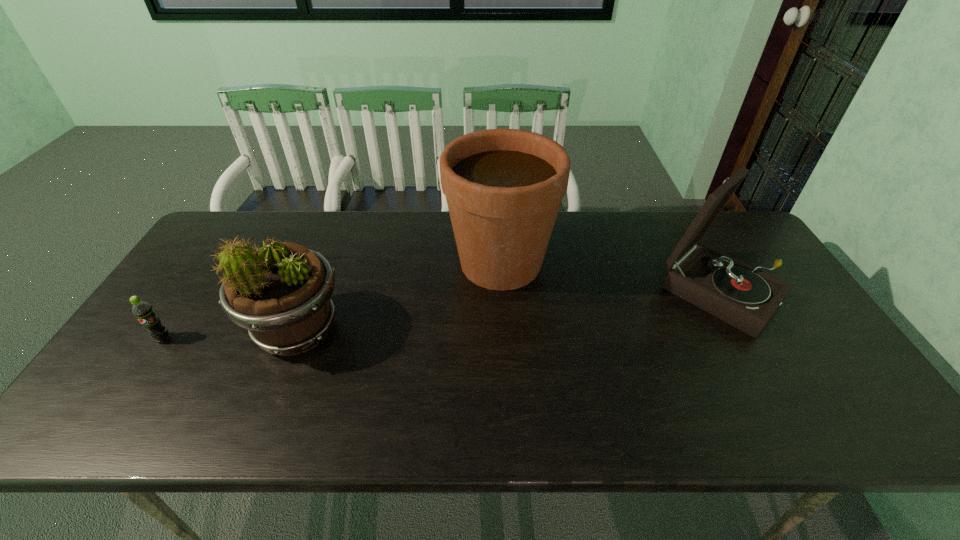
At what (x,y) coordinates should I click in order to perform the action: click on free space between the rightmost object and the left flowerpot. Please return your answer as a coordinate pair (x, y). Looking at the image, I should click on (510, 312).

The height and width of the screenshot is (540, 960). I want to click on unoccupied area between the rightmost object and the leftmost object, so (443, 316).

Where is `free point between the right flowerpot and the left flowerpot`? The width and height of the screenshot is (960, 540). free point between the right flowerpot and the left flowerpot is located at coordinates (399, 296).

Where is `vacant space that's between the right flowerpot and the third object from right to left`? The image size is (960, 540). vacant space that's between the right flowerpot and the third object from right to left is located at coordinates (399, 296).

Locate an element on the screen. The width and height of the screenshot is (960, 540). free spot between the second object from right to left and the left flowerpot is located at coordinates (399, 296).

The height and width of the screenshot is (540, 960). What are the coordinates of `free point between the second object from left to right and the rightmost object` in the screenshot? It's located at (510, 312).

Where is `vacant area between the phonograph record and the second object from left to right`? vacant area between the phonograph record and the second object from left to right is located at coordinates 510,312.

Locate which object is the third closest to the second object from right to left. Please provide its 2D coordinates. Your answer should be formatted as a tuple, i.e. [(x, y)], where the tuple contains the x and y coordinates of a point satisfying the conditions above.

[(143, 311)]

At what (x,y) coordinates should I click in order to perform the action: click on object that stands as the second closest to the shortest object. Please return your answer as a coordinate pair (x, y). Looking at the image, I should click on (504, 187).